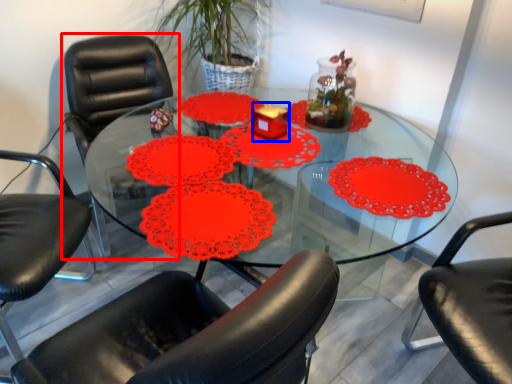
Question: Among these objects, which one is farthest to the camera, chair (highlighted by a red box) or candle holder (highlighted by a blue box)?

Choices:
 (A) chair
 (B) candle holder

Answer: (B)